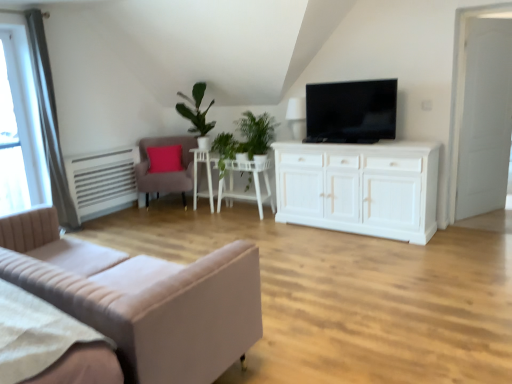
Locate an element on the screen. The image size is (512, 384). transparent glass window at upper left is located at coordinates (20, 127).

Describe the element at coordinates (20, 127) in the screenshot. I see `transparent glass window at upper left` at that location.

The width and height of the screenshot is (512, 384). What are the coordinates of `white wooden table at center` in the screenshot? It's located at (253, 181).

In order to click on white wooden door at right in this screenshot , I will do `click(482, 119)`.

Describe the element at coordinates (197, 114) in the screenshot. I see `green leafy plant at center` at that location.

Find the location of a particular element. transparent glass window at upper left is located at coordinates (20, 127).

Could you tell me if white wooden table at center is facing black glossy tv at upper center?

No, white wooden table at center does not turn towards black glossy tv at upper center.

Is white wooden table at center placed right next to black glossy tv at upper center?

white wooden table at center and black glossy tv at upper center are not in contact.

Based on the photo, how many degrees apart are the facing directions of white wooden table at center and black glossy tv at upper center?

1.25 degrees separate the facing orientations of white wooden table at center and black glossy tv at upper center.

Does point (290, 102) appear closer or farther from the camera than point (21, 174)?

Point (290, 102) is positioned closer to the camera compared to point (21, 174).

From a real-world perspective, between white glossy lamp at upper center and transparent glass window at upper left, who is vertically lower?

From a 3D spatial view, white glossy lamp at upper center is below.

Is white glossy lamp at upper center directly adjacent to transparent glass window at upper left?

white glossy lamp at upper center and transparent glass window at upper left are clearly separated.

From the image's perspective, is white glossy side table at center over black glossy tv at upper center?

No.

From the picture: Which is closer to the camera, (195, 173) or (332, 134)?

Positioned in front is point (332, 134).

Is white glossy side table at center not close to black glossy tv at upper center?

Yes.

Is green leafy plant at center directly adjacent to green leafy plant at center?

They are not placed beside each other.

Who is smaller, green leafy plant at center or green leafy plant at center?

green leafy plant at center is smaller.

Find the location of a particular element. The image size is (512, 384). plant that appears below the green leafy plant at center (from a real-world perspective) is located at coordinates (245, 139).

Which is more to the right, green leafy plant at center or green leafy plant at center?

From the viewer's perspective, green leafy plant at center appears more on the right side.

Find the location of `screen door that appears above the beige fabric studio couch at lower left (from the image's perspective)`. screen door that appears above the beige fabric studio couch at lower left (from the image's perspective) is located at coordinates (482, 119).

From the picture: Considering the sizes of objects beige fabric studio couch at lower left and white wooden door at right in the image provided, who is smaller, beige fabric studio couch at lower left or white wooden door at right?

Smaller between the two is white wooden door at right.

Consider the image. From the image's perspective, is beige fabric studio couch at lower left located above or below white wooden door at right?

beige fabric studio couch at lower left is below white wooden door at right.

Is point (251, 343) behind point (461, 199)?

No, (251, 343) is in front of (461, 199).

Is point (26, 201) closer to camera compared to point (196, 199)?

Yes, point (26, 201) is closer to viewer.

From a real-world perspective, is transparent glass window at upper left on white glossy side table at center?

Indeed, from a real-world perspective, transparent glass window at upper left stands above white glossy side table at center.

Could white glossy side table at center be considered to be inside transparent glass window at upper left?

No, transparent glass window at upper left does not contain white glossy side table at center.

Visually, is velvet pink armchair at left positioned to the left or to the right of transparent glass window at upper left?

Clearly, velvet pink armchair at left is on the right of transparent glass window at upper left in the image.

Considering the sizes of objects velvet pink armchair at left and transparent glass window at upper left in the image provided, who is taller, velvet pink armchair at left or transparent glass window at upper left?

Standing taller between the two is transparent glass window at upper left.

Is velvet pink armchair at left positioned with its back to transparent glass window at upper left?

No, velvet pink armchair at left's orientation is not away from transparent glass window at upper left.

Between point (147, 168) and point (20, 169), which one is positioned in front?

The point (20, 169) is closer to the camera.

Image resolution: width=512 pixels, height=384 pixels. Find the location of `television that is in front of the white wooden table at center`. television that is in front of the white wooden table at center is located at coordinates (351, 111).

Locate an element on the screen. window on the left of white glossy lamp at upper center is located at coordinates (20, 127).

Estimate the real-world distances between objects in this image. Which object is closer to transparent glass window at upper left, white wooden door at right or velvet pink armchair at left?

The object closer to transparent glass window at upper left is velvet pink armchair at left.

When comparing their distances from black glossy tv at upper center, does green leafy plant at center or transparent glass window at upper left seem closer?

green leafy plant at center is positioned closer to the anchor black glossy tv at upper center.

In the scene shown: From the image, which object appears to be nearer to transparent glass window at upper left, black glossy tv at upper center or green leafy plant at center?

green leafy plant at center.

From the image, which object appears to be farther from velvet pink armchair at left, white wooden door at right or white glossy side table at center?

white wooden door at right is further to velvet pink armchair at left.

In the scene shown: Looking at the image, which one is located further to green leafy plant at center, white glossy side table at center or green leafy plant at center?

green leafy plant at center is positioned further to the anchor green leafy plant at center.

Consider the image. Estimate the real-world distances between objects in this image. Which object is closer to white wooden door at right, green leafy plant at center or white glossy lamp at upper center?

white glossy lamp at upper center is positioned closer to the anchor white wooden door at right.

When comparing their distances from white wooden door at right, does white glossy side table at center or transparent glass window at upper left seem closer?

white glossy side table at center.

Based on their spatial positions, is green leafy plant at center or white glossy lamp at upper center closer to transparent glass window at upper left?

Among the two, green leafy plant at center is located nearer to transparent glass window at upper left.

The image size is (512, 384). I want to click on lamp between beige fabric studio couch at lower left and white wooden table at center from front to back, so click(x=297, y=117).

Locate an element on the screen. Image resolution: width=512 pixels, height=384 pixels. houseplant between velvet pink armchair at left and white wooden door at right in the horizontal direction is located at coordinates (197, 114).

Identify the location of studio couch between transparent glass window at upper left and black glossy tv at upper center. Image resolution: width=512 pixels, height=384 pixels. (142, 298).

At what (x,y) coordinates should I click in order to perform the action: click on table situated between velvet pink armchair at left and black glossy tv at upper center from left to right. Please return your answer as a coordinate pair (x, y). This screenshot has height=384, width=512. Looking at the image, I should click on (253, 181).